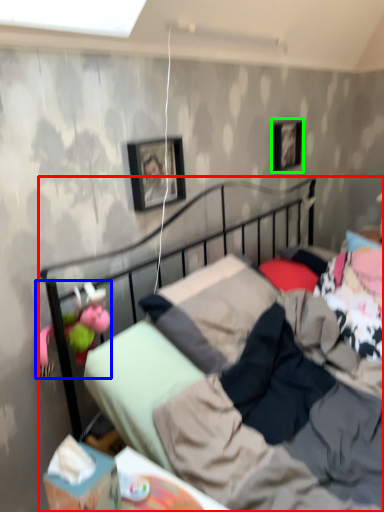
Question: Considering the real-world distances, which object is closest to bed (highlighted by a red box)? doll (highlighted by a blue box) or picture frame (highlighted by a green box).

Choices:
 (A) doll
 (B) picture frame

Answer: (A)